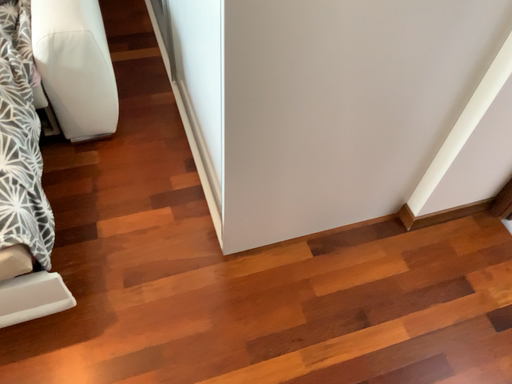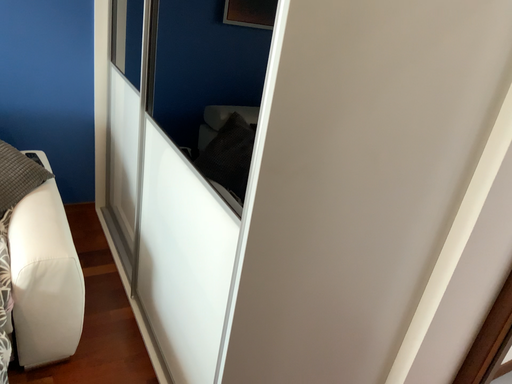
Question: Which way did the camera rotate in the video?

Choices:
 (A) rotated left
 (B) rotated right

Answer: (B)